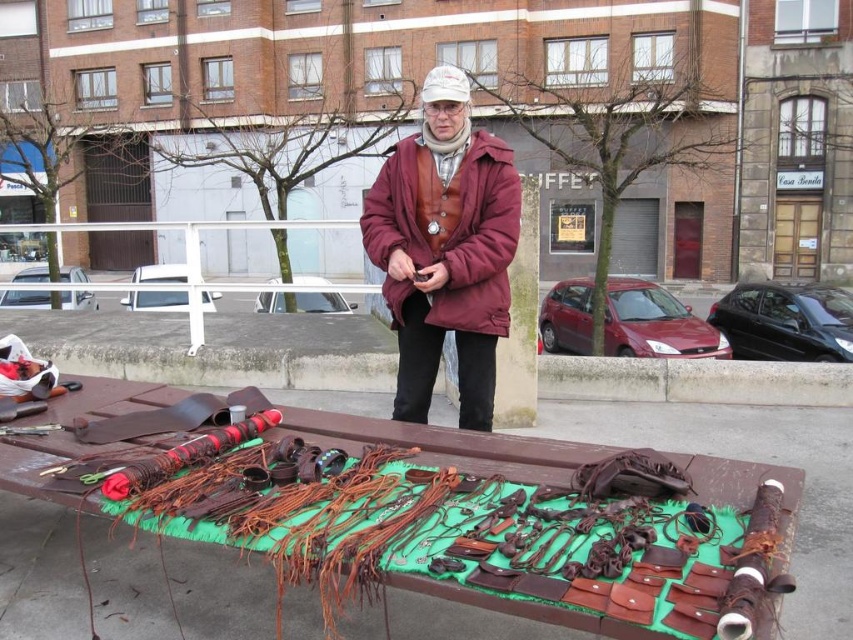
Is brown leather table at center wider than leather vest at center?

Indeed, brown leather table at center has a greater width compared to leather vest at center.

Measure the distance from brown leather table at center to leather vest at center.

brown leather table at center is 1.19 meters from leather vest at center.

Find the location of a particular element. The height and width of the screenshot is (640, 853). brown leather table at center is located at coordinates (457, 518).

Where is `brown leather table at center`? The height and width of the screenshot is (640, 853). brown leather table at center is located at coordinates point(457,518).